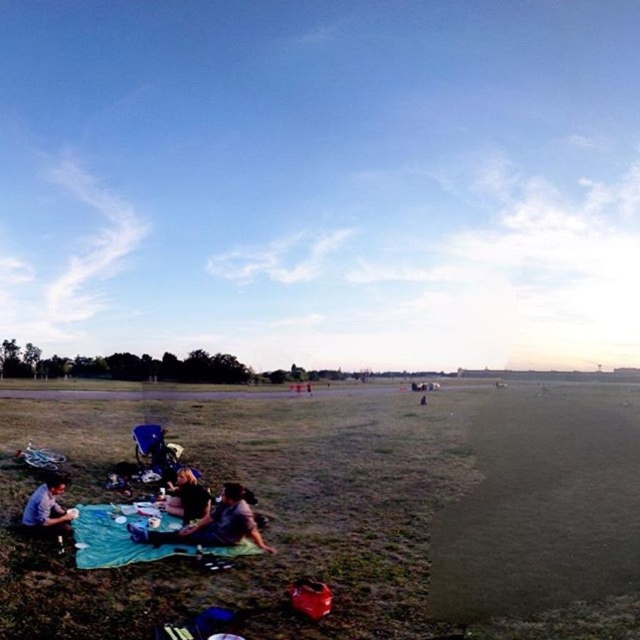
Question: Which point is closer to the camera?

Choices:
 (A) blue fabric picnic blanket at lower left
 (B) dark gray fabric at lower center
 (C) dark brown hair at lower left
 (D) matte blue shirt at lower left

Answer: (A)

Question: Is blue fabric picnic blanket at lower left thinner than dark brown hair at lower left?

Choices:
 (A) yes
 (B) no

Answer: (B)

Question: Which point appears farthest from the camera in this image?

Choices:
 (A) (186, 476)
 (B) (106, 508)
 (C) (49, 484)

Answer: (A)

Question: Is blue fabric picnic blanket at lower left closer to the viewer compared to matte blue shirt at lower left?

Choices:
 (A) yes
 (B) no

Answer: (A)

Question: Is dark gray fabric at lower center to the left of matte blue shirt at lower left from the viewer's perspective?

Choices:
 (A) no
 (B) yes

Answer: (A)

Question: Among these points, which one is farthest from the camera?

Choices:
 (A) (168, 508)
 (B) (218, 524)

Answer: (A)